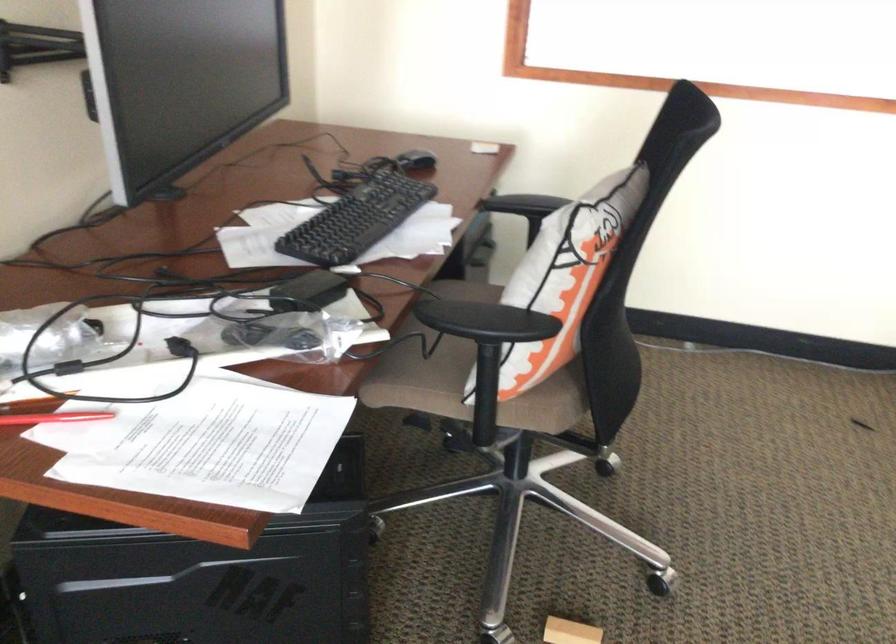
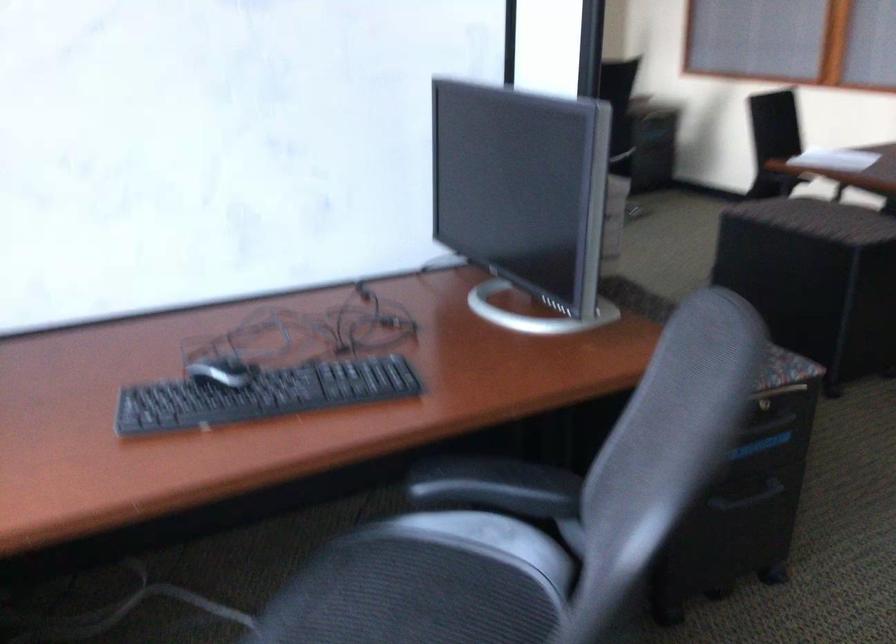
Question: I am providing you with two images of the same scene from different viewpoints. Please identify which objects are invisible in image2.

Choices:
 (A) computer mouse
 (B) red pen
 (C) chair sitting surface
 (D) pink eye mask

Answer: (B)